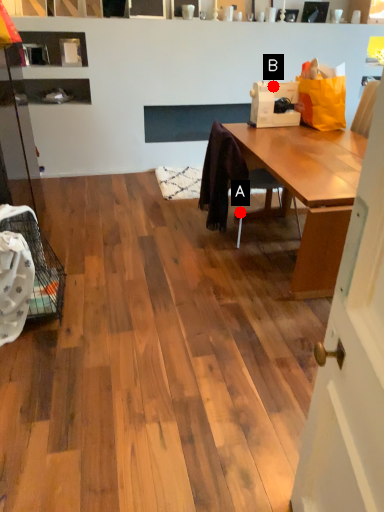
Question: Two points are circled on the image, labeled by A and B beside each circle. Which point is closer to the camera taking this photo?

Choices:
 (A) A is closer
 (B) B is closer

Answer: (A)